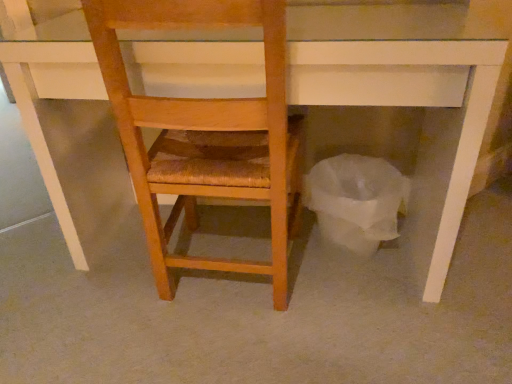
Where is `white paper bag at lower right`? The image size is (512, 384). white paper bag at lower right is located at coordinates (356, 200).

Measure the distance between white paper bag at lower right and camera.

white paper bag at lower right and camera are 4.14 feet apart.

The width and height of the screenshot is (512, 384). What do you see at coordinates (356, 200) in the screenshot?
I see `white paper bag at lower right` at bounding box center [356, 200].

What do you see at coordinates (205, 134) in the screenshot? The height and width of the screenshot is (384, 512). I see `wooden chair at center` at bounding box center [205, 134].

Where is `wooden chair at center`? wooden chair at center is located at coordinates (205, 134).

This screenshot has height=384, width=512. I want to click on white paper bag at lower right, so click(x=356, y=200).

Which object is positioned more to the right, wooden chair at center or white paper bag at lower right?

From the viewer's perspective, white paper bag at lower right appears more on the right side.

Which is behind, wooden chair at center or white paper bag at lower right?

white paper bag at lower right is behind.

Which point is more distant from viewer, (232, 104) or (358, 242)?

Point (358, 242)

From the image's perspective, is wooden chair at center on white paper bag at lower right?

Yes, from the image's perspective, wooden chair at center is above white paper bag at lower right.

From a real-world perspective, between wooden chair at center and white paper bag at lower right, who is vertically higher?

wooden chair at center, from a real-world perspective.

Does wooden chair at center have a lesser width compared to white paper bag at lower right?

No, wooden chair at center is not thinner than white paper bag at lower right.

Is wooden chair at center taller or shorter than white paper bag at lower right?

Clearly, wooden chair at center is taller compared to white paper bag at lower right.

Between wooden chair at center and white paper bag at lower right, which one has smaller size?

Smaller between the two is white paper bag at lower right.

Which is correct: wooden chair at center is inside white paper bag at lower right, or outside of it?

wooden chair at center is not inside white paper bag at lower right, it's outside.

Is wooden chair at center placed right next to white paper bag at lower right?

There is a gap between wooden chair at center and white paper bag at lower right.

Is wooden chair at center facing towards white paper bag at lower right?

No, wooden chair at center is not aimed at white paper bag at lower right.

Can you tell me how much wooden chair at center and white paper bag at lower right differ in facing direction?

The angle between the facing direction of wooden chair at center and the facing direction of white paper bag at lower right is 179 degrees.

I want to click on chair above the white paper bag at lower right (from the image's perspective), so click(x=205, y=134).

Is white paper bag at lower right to the left of wooden chair at center from the viewer's perspective?

In fact, white paper bag at lower right is to the right of wooden chair at center.

Is white paper bag at lower right positioned behind wooden chair at center?

That is True.

Which point is more forward, (361, 187) or (275, 173)?

The point (275, 173) is in front.

From the image's perspective, which one is positioned higher, white paper bag at lower right or wooden chair at center?

wooden chair at center is shown above in the image.

From a real-world perspective, which is physically below, white paper bag at lower right or wooden chair at center?

From a 3D spatial view, white paper bag at lower right is below.

Is white paper bag at lower right wider or thinner than wooden chair at center?

In the image, white paper bag at lower right appears to be more narrow than wooden chair at center.

Which of these two, white paper bag at lower right or wooden chair at center, stands shorter?

white paper bag at lower right.

Who is bigger, white paper bag at lower right or wooden chair at center?

wooden chair at center.

Is wooden chair at center inside white paper bag at lower right?

No, wooden chair at center is not inside white paper bag at lower right.

Are white paper bag at lower right and wooden chair at center making contact?

There is a gap between white paper bag at lower right and wooden chair at center.

Is white paper bag at lower right oriented away from wooden chair at center?

No.

How different are the orientations of white paper bag at lower right and wooden chair at center in degrees?

The facing directions of white paper bag at lower right and wooden chair at center are 179 degrees apart.

Find the location of a particular element. The height and width of the screenshot is (384, 512). chair above the white paper bag at lower right (from a real-world perspective) is located at coordinates (205, 134).

Where is `garbage lying below the wooden chair at center (from the image's perspective)`? garbage lying below the wooden chair at center (from the image's perspective) is located at coordinates (356, 200).

The height and width of the screenshot is (384, 512). I want to click on chair in front of the white paper bag at lower right, so click(x=205, y=134).